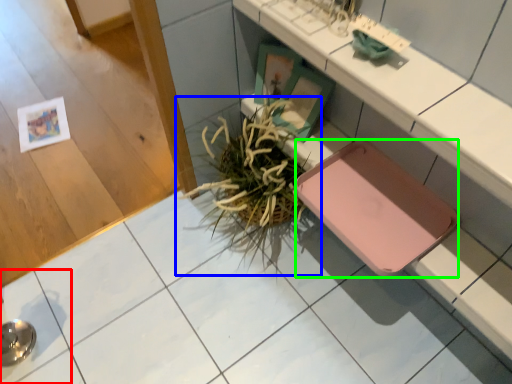
Question: Considering the real-world distances, which object is farthest from square (highlighted by a red box)? houseplant (highlighted by a blue box) or pad (highlighted by a green box)?

Choices:
 (A) houseplant
 (B) pad

Answer: (B)